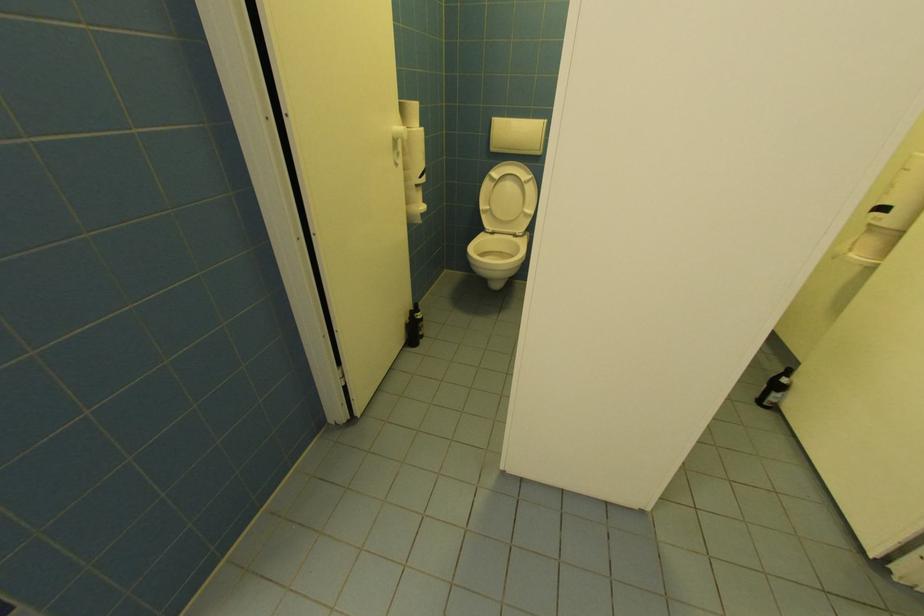
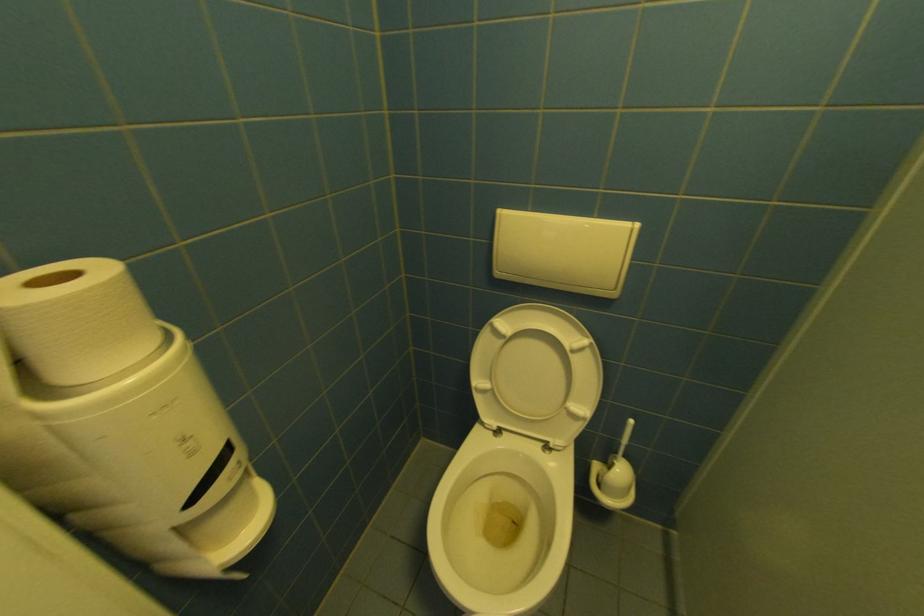
Question: In a continuous first-person perspective shot, in which direction is the camera moving?

Choices:
 (A) Left
 (B) Right
 (C) Forward
 (D) Backward

Answer: (C)